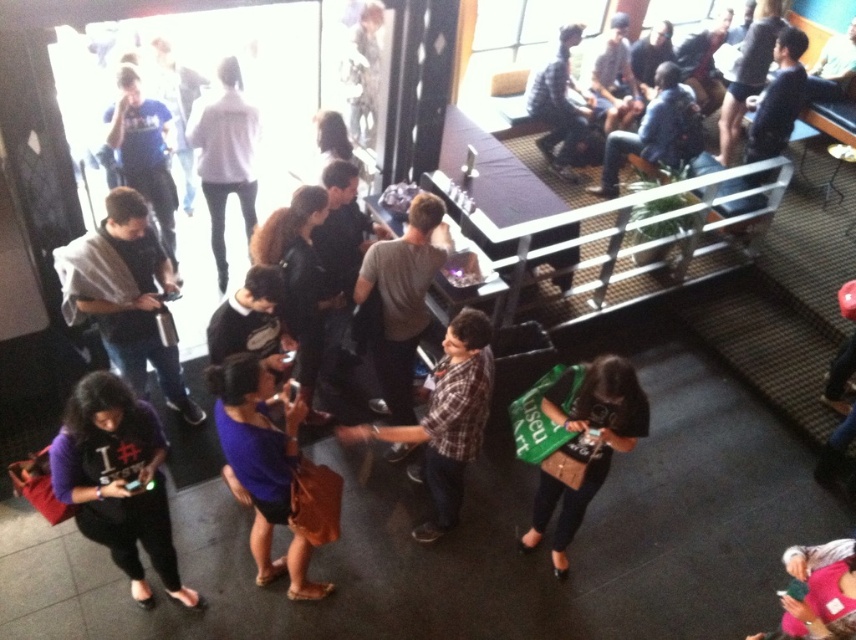
Question: Which object is closer to the camera taking this photo?

Choices:
 (A) plaid shirt at center
 (B) purple matte shirt at lower left
 (C) light gray sweater at center
 (D) green fabric bag at center

Answer: (B)

Question: Is purple matte shirt at lower left below green fabric bag at center?

Choices:
 (A) yes
 (B) no

Answer: (A)

Question: Which point is closer to the camera?

Choices:
 (A) light gray sweater at center
 (B) purple fabric shirt at center
 (C) matte black shirt at left

Answer: (B)

Question: Among these objects, which one is farthest from the camera?

Choices:
 (A) plaid shirt at upper center
 (B) green fabric bag at center
 (C) dark blue jeans at center
 (D) dark gray sweater at center

Answer: (A)

Question: Can you confirm if light gray sweater at center is thinner than matte black shirt at left?

Choices:
 (A) yes
 (B) no

Answer: (B)

Question: Can you confirm if green fabric bag at center is thinner than dark blue jeans at center?

Choices:
 (A) yes
 (B) no

Answer: (A)